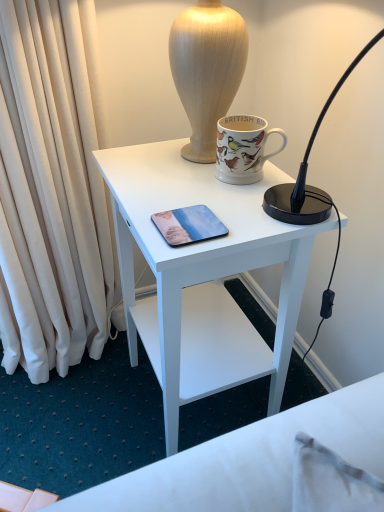
Where is `vacant space to the left of matte ceramic mug at upper center`? This screenshot has width=384, height=512. vacant space to the left of matte ceramic mug at upper center is located at coordinates tap(169, 179).